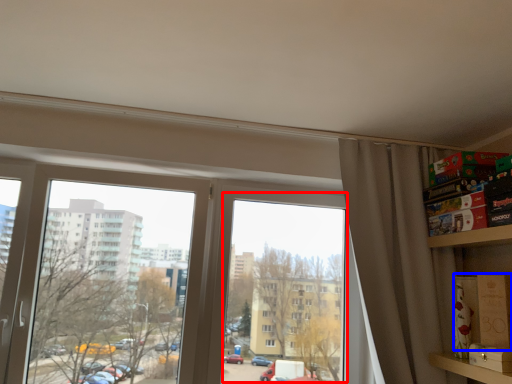
Question: Which point is closer to the camera, window screen (highlighted by a red box) or cardboard box (highlighted by a blue box)?

Choices:
 (A) window screen
 (B) cardboard box

Answer: (B)